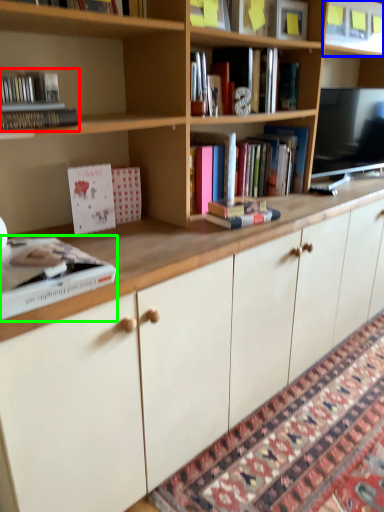
Question: Which is farther away from book (highlighted by a red box)? shelf (highlighted by a blue box) or book (highlighted by a green box)?

Choices:
 (A) shelf
 (B) book

Answer: (A)